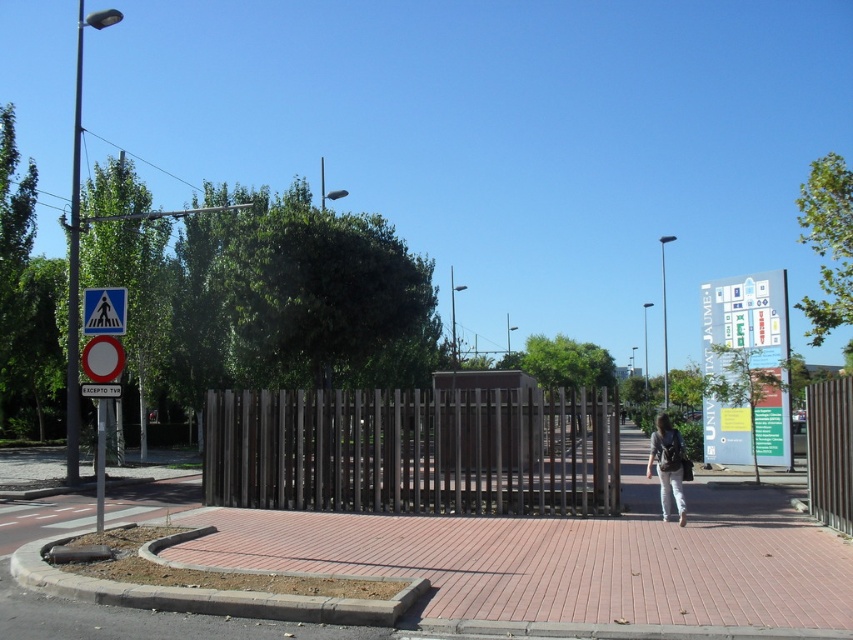
Does brown wooden fence at center have a lesser height compared to white plastic pedestrian crossing sign at upper left?

No, brown wooden fence at center is not shorter than white plastic pedestrian crossing sign at upper left.

This screenshot has height=640, width=853. Find the location of `brown wooden fence at center`. brown wooden fence at center is located at coordinates (415, 451).

Which is behind, point (236, 429) or point (676, 448)?

Positioned behind is point (236, 429).

Is brown wooden fence at center smaller than white denim pants at center?

No.

This screenshot has width=853, height=640. Identify the location of brown wooden fence at center. (415, 451).

Is point (659, 497) farther from camera compared to point (115, 323)?

Yes, it is.

Between point (665, 465) and point (107, 316), which one is positioned behind?

The point (665, 465) is behind.

In order to click on white denim pants at center in this screenshot , I will do 666,465.

Identify the location of white denim pants at center. (666, 465).